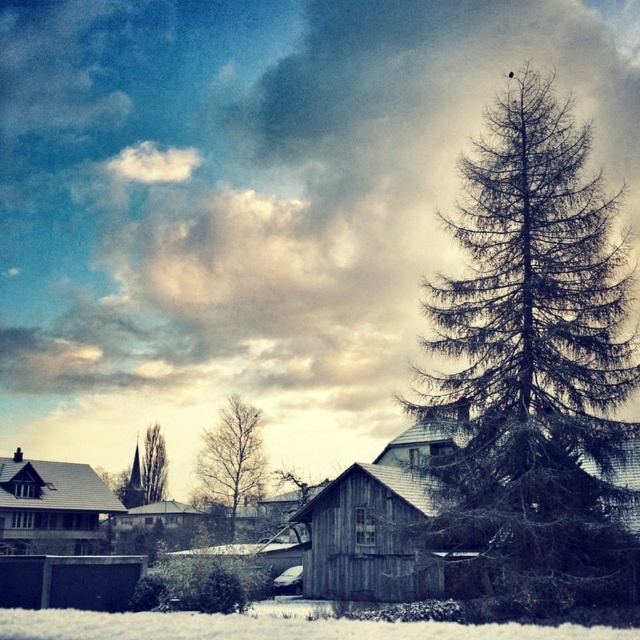
You are an observer standing in the snow in front of the barn. You see the dark green textured pine tree at right and the bare branches at center. Which object is higher in the scene?

The dark green textured pine tree at right is located above the bare branches at center, so it is higher in the scene.

You are standing in the snowy field and want to reach both the wooden shack at center and the wooden hut at center. Which one should you approach first if you want to visit the closer one first?

You should approach the wooden shack at center first because it is closer to the viewer than the wooden hut at center.